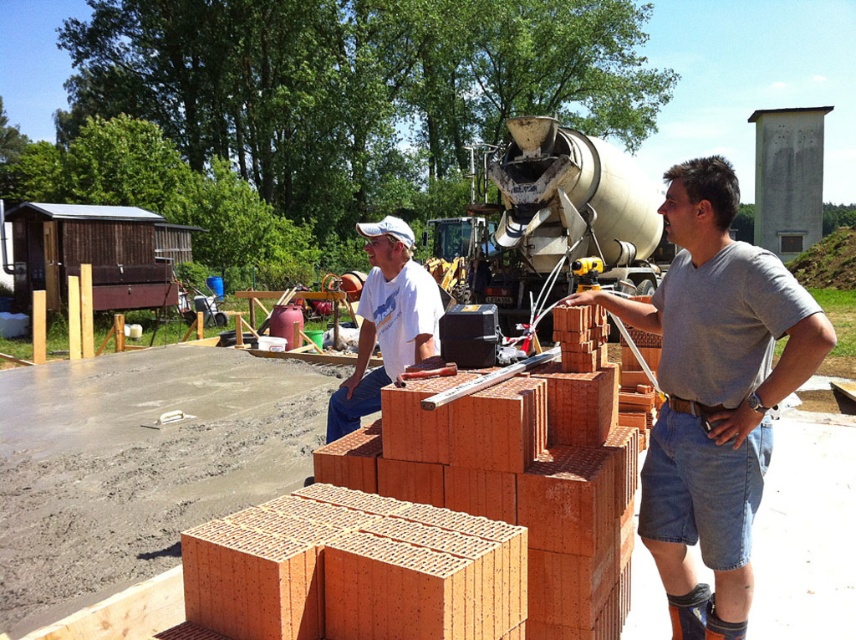
Question: Considering the relative positions of smooth concrete at lower left and matte gray shirt at center in the image provided, where is smooth concrete at lower left located with respect to matte gray shirt at center?

Choices:
 (A) right
 (B) left

Answer: (B)

Question: Among these objects, which one is farthest from the camera?

Choices:
 (A) smooth concrete at lower left
 (B) matte gray shirt at center

Answer: (A)

Question: From the image, what is the correct spatial relationship of smooth concrete at lower left in relation to white cotton shirt at center?

Choices:
 (A) above
 (B) below

Answer: (B)

Question: Which point is farther to the camera?

Choices:
 (A) (295, 380)
 (B) (706, 248)
 (C) (428, 280)

Answer: (A)

Question: Is smooth concrete at lower left below matte gray shirt at center?

Choices:
 (A) no
 (B) yes

Answer: (B)

Question: Which is nearer to the white cotton shirt at center?

Choices:
 (A) smooth concrete at lower left
 (B) matte gray shirt at center

Answer: (B)